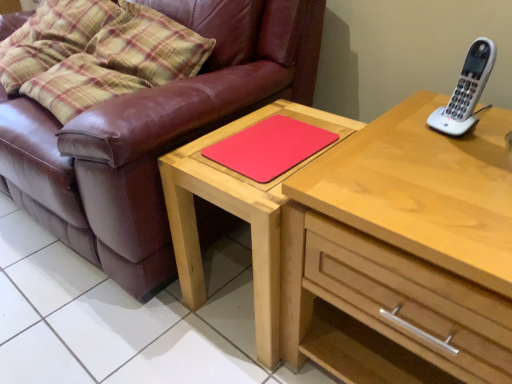
Question: Is white plastic phone at upper right inside or outside of light wood chest of drawers at upper right?

Choices:
 (A) inside
 (B) outside

Answer: (B)

Question: In terms of size, does white plastic phone at upper right appear bigger or smaller than light wood chest of drawers at upper right?

Choices:
 (A) small
 (B) big

Answer: (A)

Question: Based on their relative distances, which object is farther from the brown leather couch at left?

Choices:
 (A) light wood chest of drawers at upper right
 (B) matte wooden table at center
 (C) white plastic phone at upper right
 (D) rubberized red mousepad at center

Answer: (C)

Question: Based on their relative distances, which object is nearer to the light wood chest of drawers at upper right?

Choices:
 (A) rubberized red mousepad at center
 (B) matte wooden table at center
 (C) white plastic phone at upper right
 (D) brown leather couch at left

Answer: (B)